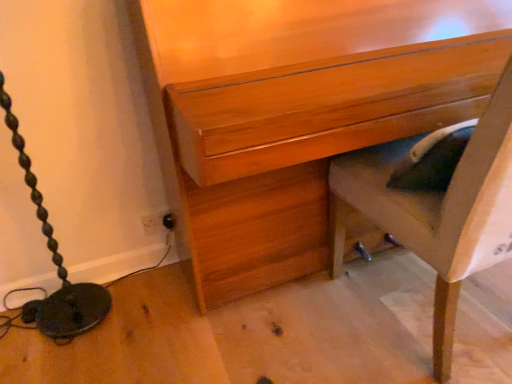
Question: From a real-world perspective, is wooden chest of drawers at center physically located above or below wooden chair at lower right?

Choices:
 (A) above
 (B) below

Answer: (A)

Question: Would you say wooden chest of drawers at center is to the left or to the right of wooden chair at lower right in the picture?

Choices:
 (A) right
 (B) left

Answer: (B)

Question: From the image's perspective, is wooden chest of drawers at center above or below wooden chair at lower right?

Choices:
 (A) below
 (B) above

Answer: (B)

Question: Is wooden chair at lower right spatially inside wooden chest of drawers at center, or outside of it?

Choices:
 (A) outside
 (B) inside

Answer: (B)

Question: From a real-world perspective, is wooden chair at lower right positioned above or below wooden chest of drawers at center?

Choices:
 (A) below
 (B) above

Answer: (A)

Question: Looking at their shapes, would you say wooden chair at lower right is wider or thinner than wooden chest of drawers at center?

Choices:
 (A) thin
 (B) wide

Answer: (B)

Question: From the image's perspective, is wooden chair at lower right positioned above or below wooden chest of drawers at center?

Choices:
 (A) above
 (B) below

Answer: (B)